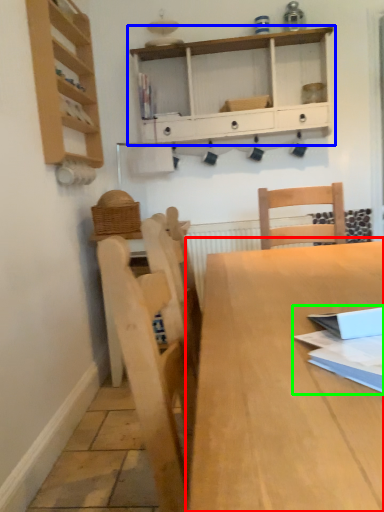
Question: Which object is the farthest from table (highlighted by a red box)? Choose among these: shelf (highlighted by a blue box) or book (highlighted by a green box).

Choices:
 (A) shelf
 (B) book

Answer: (A)